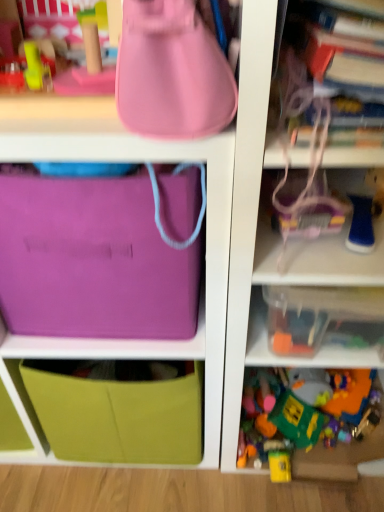
Question: Considering the positions of purple fabric bag at upper left and matte pink handbag at upper center in the image, is purple fabric bag at upper left wider or thinner than matte pink handbag at upper center?

Choices:
 (A) thin
 (B) wide

Answer: (B)

Question: Based on their sizes in the image, would you say purple fabric bag at upper left is bigger or smaller than matte pink handbag at upper center?

Choices:
 (A) big
 (B) small

Answer: (A)

Question: Considering the real-world distances, which object is closest to the translucent plastic container at center right, arranged as the 2th shelf when ordered from the bottom?

Choices:
 (A) blue rubber toy at right, acting as the 2th toy starting from the bottom
 (B) matte pink handbag at upper center
 (C) purple fabric bag at upper left
 (D) matte green fabric drawer at lower left
 (E) translucent plastic container at lower right, marked as the first toy in a bottom-to-top arrangement

Answer: (C)

Question: Which object is the closest to the purple fabric bag at upper left?

Choices:
 (A) translucent plastic container at center right, arranged as the 2th shelf when ordered from the bottom
 (B) blue rubber toy at right, which is the first toy in top-to-bottom order
 (C) matte green fabric drawer at lower left
 (D) matte pink handbag at upper center
 (E) matte purple pouch at center

Answer: (E)